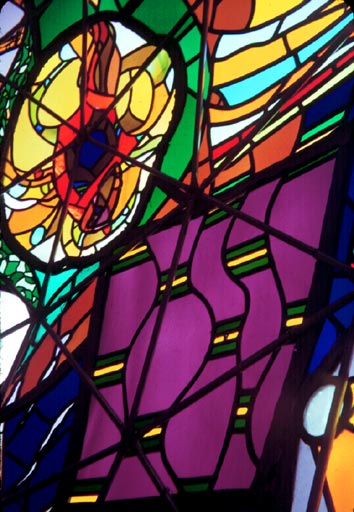
Locate an element on the screen. The image size is (354, 512). light green glass is located at coordinates (188, 41), (195, 72), (12, 266), (326, 124), (232, 181).